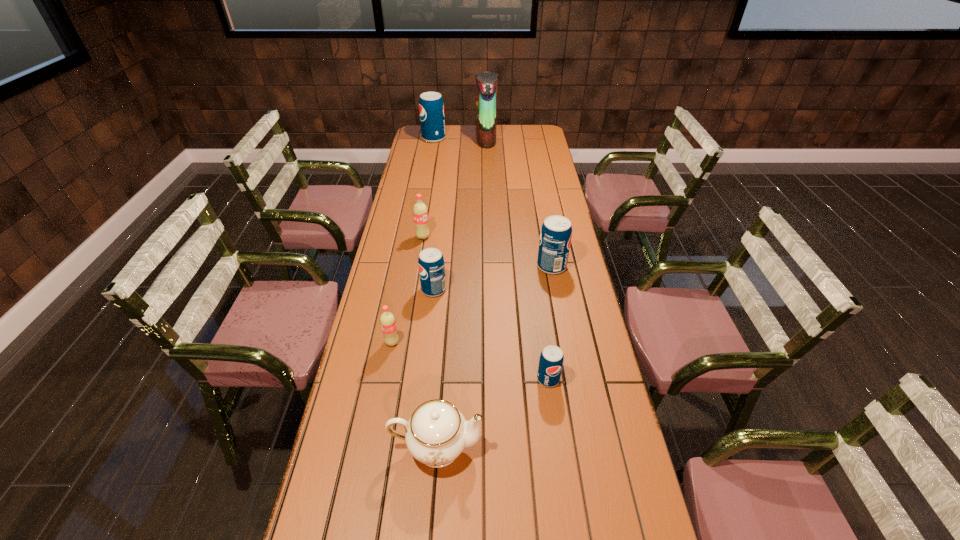
Locate an element on the screen. This screenshot has width=960, height=540. free point at the far left corner is located at coordinates (416, 133).

Where is `vacant space at the far right corner of the desktop`? The image size is (960, 540). vacant space at the far right corner of the desktop is located at coordinates (521, 134).

This screenshot has height=540, width=960. Identify the location of unoccupied area between the nearest blue pop and the biggest blue pop. (492, 259).

You are a GUI agent. You are given a task and a screenshot of the screen. Output one action in this format:
    pyautogui.click(x=<x>, y=<y>)
    Task: Click on the free point between the sixth nearest object and the smaller red soda
    
    Given the screenshot: What is the action you would take?
    pyautogui.click(x=408, y=290)

Locate an element on the screen. The image size is (960, 540). unoccupied position between the nearer red soda and the second farthest pop is located at coordinates (408, 290).

I want to click on vacant area that lies between the smallest blue pop and the tallest object, so click(517, 259).

Locate an element on the screen. This screenshot has height=540, width=960. free space between the parrot and the nearer red soda is located at coordinates (439, 241).

This screenshot has height=540, width=960. I want to click on free point between the second nearest pop and the parrot, so click(x=439, y=241).

Locate an element on the screen. This screenshot has width=960, height=540. object identified as the third closest to the third nearest blue pop is located at coordinates (420, 212).

At what (x,y) coordinates should I click in order to perform the action: click on object that is the seventh closest to the tallest object. Please return your answer as a coordinate pair (x, y). Looking at the image, I should click on (436, 434).